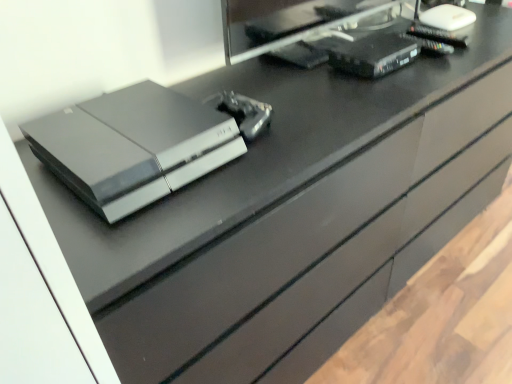
Where is `vacant area in front of metallic silver controller at center, the 2th equipment viewed from the back`? vacant area in front of metallic silver controller at center, the 2th equipment viewed from the back is located at coordinates (246, 170).